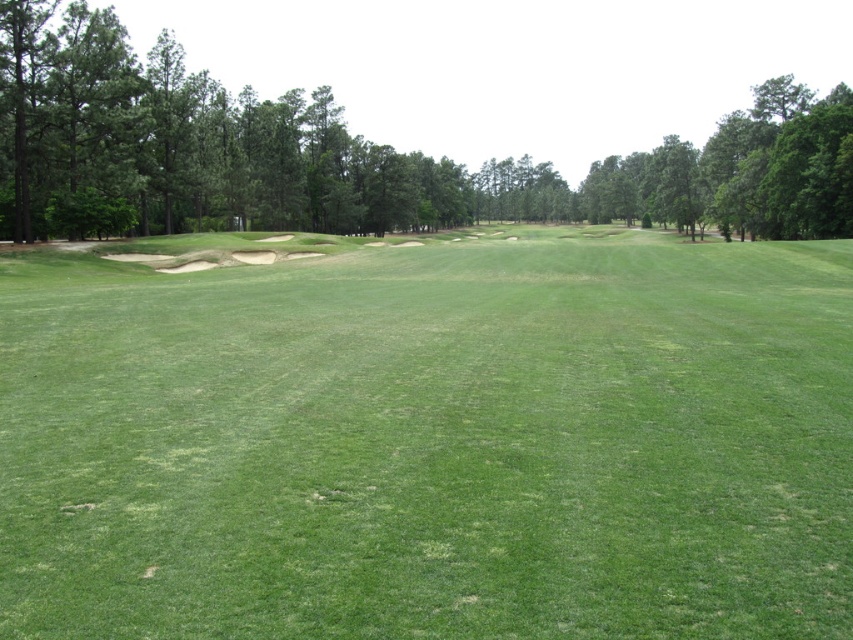
This screenshot has height=640, width=853. Describe the element at coordinates (431, 442) in the screenshot. I see `green grassy field at center` at that location.

Which is above, green grassy field at center or green leafy tree at center?

green leafy tree at center is higher up.

At what (x,y) coordinates should I click in order to perform the action: click on green grassy field at center. Please return your answer as a coordinate pair (x, y). Looking at the image, I should click on (431, 442).

Locate an element on the screen. green grassy field at center is located at coordinates coord(431,442).